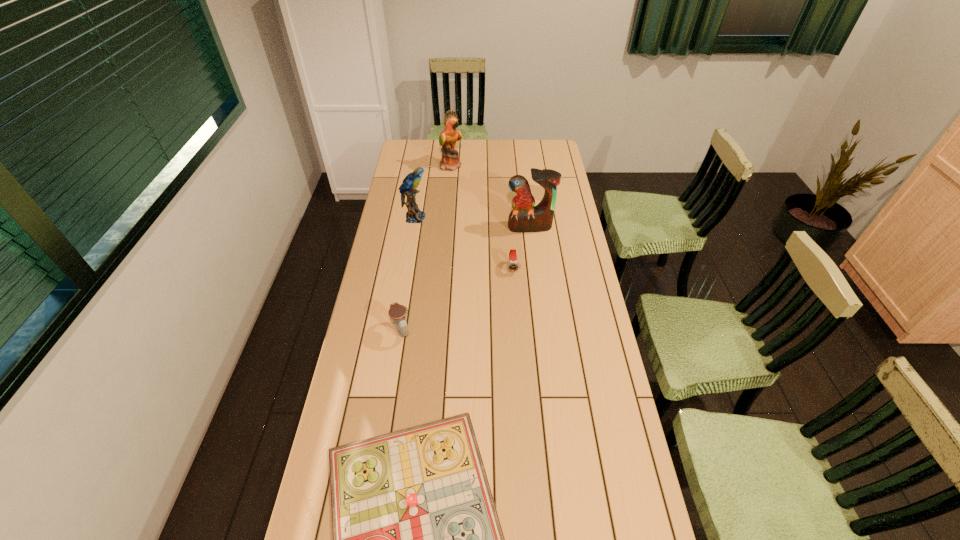
Choose which parrot is the nearest neighbor to the leftmost parrot. Please provide its 2D coordinates. Your answer should be formatted as a tuple, i.e. [(x, y)], where the tuple contains the x and y coordinates of a point satisfying the conditions above.

[(450, 161)]

Locate an element on the screen. Image resolution: width=960 pixels, height=540 pixels. free spot that satisfies the following two spatial constraints: 1. on the face of the second nearest object; 2. on the left side of the leftmost parrot is located at coordinates coord(396,330).

Where is `free spot that satisfies the following two spatial constraints: 1. on the face of the left watch; 2. on the right side of the leftmost parrot`? This screenshot has width=960, height=540. free spot that satisfies the following two spatial constraints: 1. on the face of the left watch; 2. on the right side of the leftmost parrot is located at coordinates (396, 330).